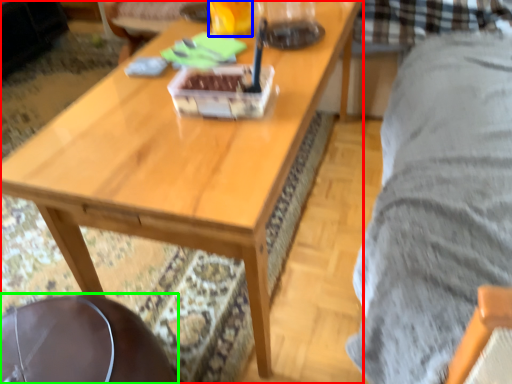
Question: Which is nearer to the coffee table (highlighted by a red box)? beverage (highlighted by a blue box) or swivel chair (highlighted by a green box).

Choices:
 (A) beverage
 (B) swivel chair

Answer: (B)